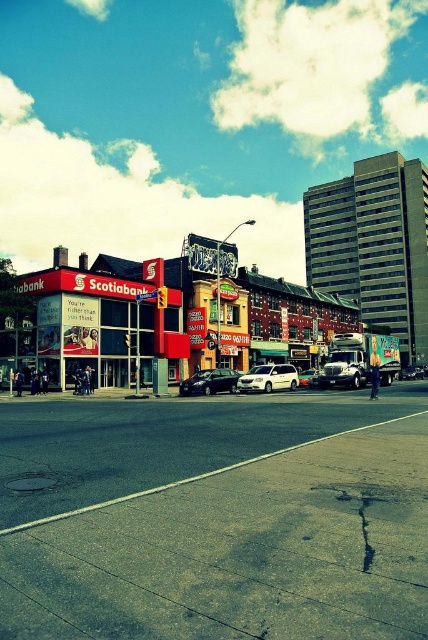
Which is more to the right, shiny black sedan at center or silver metallic sedan at center?

silver metallic sedan at center

What do you see at coordinates (210, 381) in the screenshot?
I see `shiny black sedan at center` at bounding box center [210, 381].

This screenshot has height=640, width=428. I want to click on shiny black sedan at center, so click(x=210, y=381).

Is point (380, 481) behind point (276, 368)?

No, (380, 481) is in front of (276, 368).

Is asphalt at center above silver metallic minivan at center?

Correct, asphalt at center is located above silver metallic minivan at center.

Does point (70, 532) lie behind point (262, 384)?

No, it is in front of (262, 384).

Where is `asphalt at center`? The height and width of the screenshot is (640, 428). asphalt at center is located at coordinates (214, 516).

Is point (253, 516) farther from viewer compared to point (74, 282)?

No, (253, 516) is closer to viewer.

Can you confirm if asphalt at center is positioned to the left of matte red bank at center?

Incorrect, asphalt at center is not on the left side of matte red bank at center.

Does point (419, 563) come farther from viewer compared to point (82, 280)?

No.

The height and width of the screenshot is (640, 428). Identify the location of asphalt at center. (214, 516).